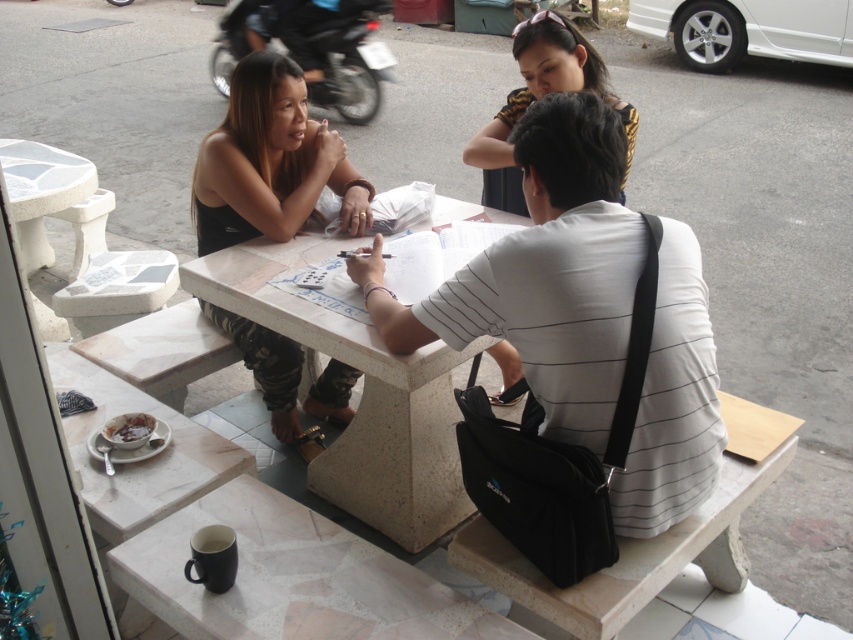
Based on the photo, you are a photographer standing at a distance. You want to take a photo of the white marble table at center and the camouflage pants at center. Which object will appear larger in your photo?

The white marble table at center will appear larger in the photo because it is closer to the viewer than the camouflage pants at center.

You are standing at the entrance of the cafe and want to join the group sitting at the white marble table at center. If you walk straight ahead, will you reach the table directly without needing to adjust your path?

The white marble table at center is located at coordinates point [361,394], so if you walk straight ahead from the entrance, you will reach the table directly without needing to adjust your path.

You are a photographer standing at the edge of the scene. You want to take a photo of the white marble table at center and the metallic blue motorcycle at upper left. Which object will appear larger in your photo?

The white marble table at center will appear larger in the photo because it is closer to the viewer than the metallic blue motorcycle at upper left.